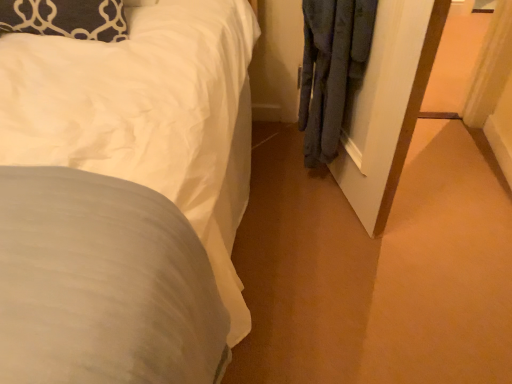
At what (x,y) coordinates should I click in order to perform the action: click on dark blue textured pillow at upper left. Please return your answer as a coordinate pair (x, y). Looking at the image, I should click on (65, 18).

Describe the element at coordinates (65, 18) in the screenshot. I see `dark blue textured pillow at upper left` at that location.

What is the approximate height of dark blue textured pillow at upper left?

dark blue textured pillow at upper left is 4.67 inches in height.

This screenshot has height=384, width=512. I want to click on dark blue textured pillow at upper left, so click(x=65, y=18).